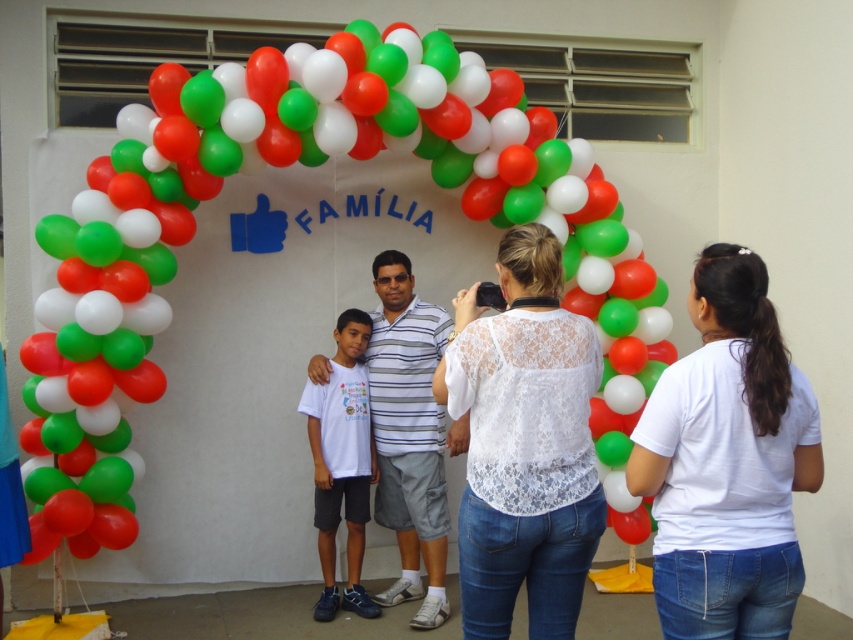
From the picture: Can you confirm if rubber balloons at center is bigger than white lace shirt at center?

Yes, rubber balloons at center is bigger than white lace shirt at center.

Is rubber balloons at center in front of white lace shirt at center?

No, it is not.

This screenshot has width=853, height=640. Describe the element at coordinates (358, 152) in the screenshot. I see `rubber balloons at center` at that location.

The height and width of the screenshot is (640, 853). In order to click on rubber balloons at center in this screenshot , I will do `click(358, 152)`.

Who is positioned more to the right, rubber balloons at center or white lace blouse at center?

white lace blouse at center is more to the right.

Does rubber balloons at center have a smaller size compared to white lace blouse at center?

No, rubber balloons at center is not smaller than white lace blouse at center.

Is point (183, 236) positioned in front of point (538, 269)?

No, it is not.

Image resolution: width=853 pixels, height=640 pixels. In order to click on rubber balloons at center in this screenshot , I will do `click(358, 152)`.

Is point (157, 97) more distant than point (321, 371)?

No, (157, 97) is in front of (321, 371).

I want to click on rubber balloons at center, so click(358, 152).